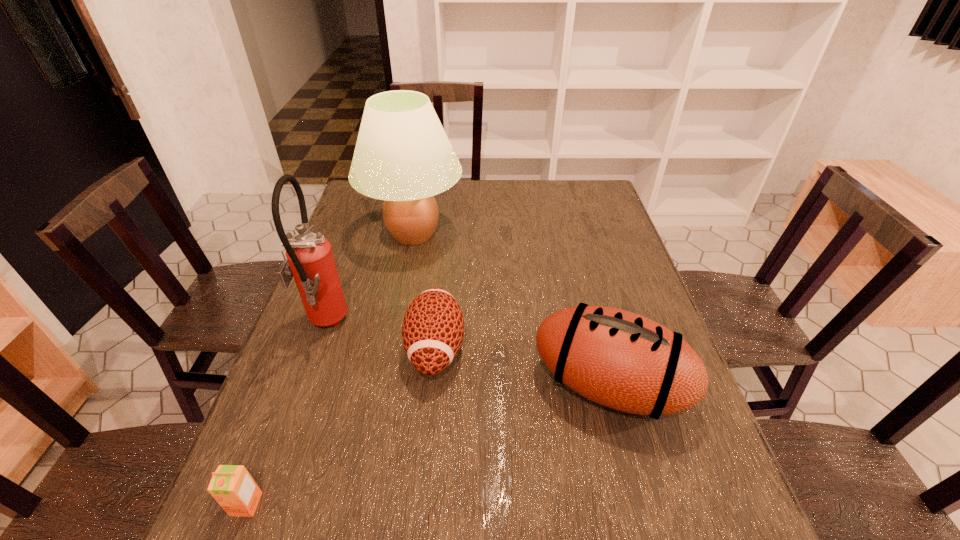
Locate an element on the screen. lampshade is located at coordinates (403, 156).

Where is `fire extinguisher`? fire extinguisher is located at coordinates (310, 260).

The width and height of the screenshot is (960, 540). I want to click on the right football, so click(619, 359).

The image size is (960, 540). I want to click on the rightmost object, so click(x=619, y=359).

Find the location of a particular element. This screenshot has height=540, width=960. the shorter football is located at coordinates (433, 327).

The width and height of the screenshot is (960, 540). In order to click on the second shortest object in this screenshot , I will do `click(433, 327)`.

Identify the location of the nearest object. (232, 486).

Locate an element on the screen. Image resolution: width=960 pixels, height=540 pixels. the shortest object is located at coordinates (232, 486).

You are a GUI agent. You are given a task and a screenshot of the screen. Output one action in this format:
    pyautogui.click(x=<x>, y=<y>)
    Task: Click on the free region located on the shade of the lampshade
    This screenshot has width=960, height=540.
    Given the screenshot: What is the action you would take?
    pyautogui.click(x=516, y=234)

Locate an element on the screen. vacant space located 0.230m at the nozzle of the fire extinguisher is located at coordinates (437, 326).